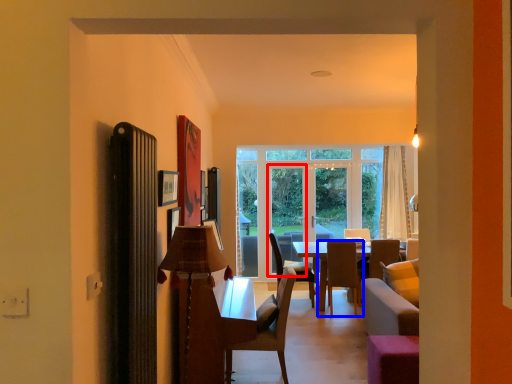
Question: Which point is closer to the camera, screen door (highlighted by a red box) or chair (highlighted by a blue box)?

Choices:
 (A) screen door
 (B) chair

Answer: (B)